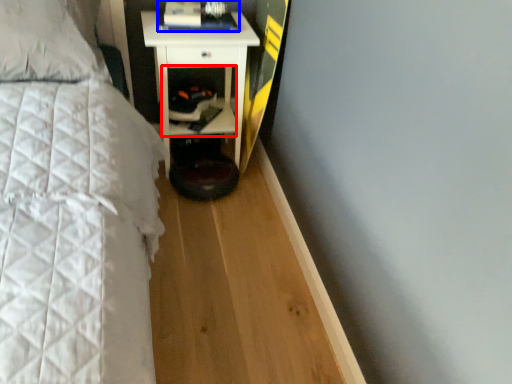
Question: Which of the following is the closest to the observer, cabinet (highlighted by a red box) or book (highlighted by a blue box)?

Choices:
 (A) cabinet
 (B) book

Answer: (B)